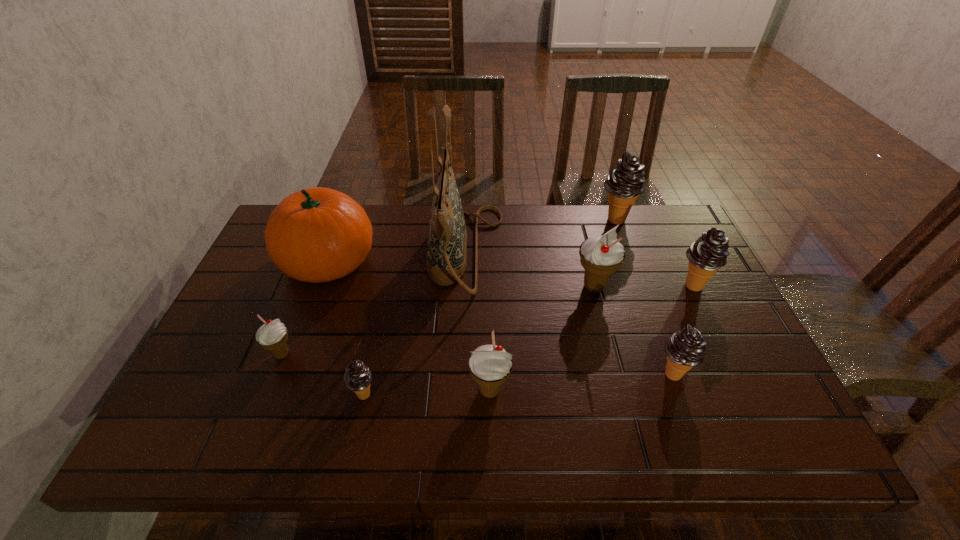
At what (x,y) coordinates should I click in order to perform the action: click on handbag. Please return your answer as a coordinate pair (x, y). Image resolution: width=960 pixels, height=540 pixels. Looking at the image, I should click on (447, 237).

At what (x,y) coordinates should I click in order to perform the action: click on the tallest icecream. Please return your answer as a coordinate pair (x, y). Looking at the image, I should click on (625, 182).

This screenshot has width=960, height=540. I want to click on the farthest chocolate icecream, so click(625, 182).

Locate an element on the screen. The image size is (960, 540). pumpkin is located at coordinates (318, 234).

This screenshot has height=540, width=960. What are the coordinates of `the rightmost object` in the screenshot? It's located at (708, 254).

The height and width of the screenshot is (540, 960). Find the location of `the third smallest chocolate icecream`. the third smallest chocolate icecream is located at coordinates (708, 254).

Identify the location of the fourth object from right to left. (601, 255).

Where is `the biggest white icecream`? This screenshot has width=960, height=540. the biggest white icecream is located at coordinates click(601, 255).

You are a GUI agent. You are given a task and a screenshot of the screen. Output one action in this format:
    pyautogui.click(x=<x>, y=<y>)
    Task: Click on the second smallest chocolate icecream
    The height and width of the screenshot is (540, 960).
    Given the screenshot: What is the action you would take?
    coord(686,348)

Locate an element on the screen. Image resolution: width=960 pixels, height=540 pixels. the second white icecream from right to left is located at coordinates (490, 366).